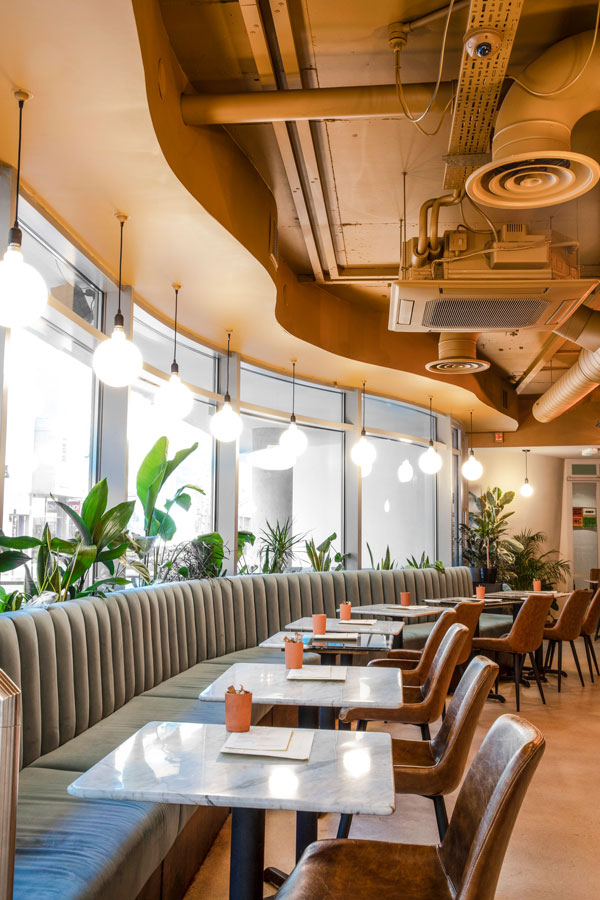
Locate an element on the screen. The height and width of the screenshot is (900, 600). tables is located at coordinates (360, 770), (366, 698), (375, 641), (387, 628), (422, 610), (499, 603), (513, 594), (549, 591).